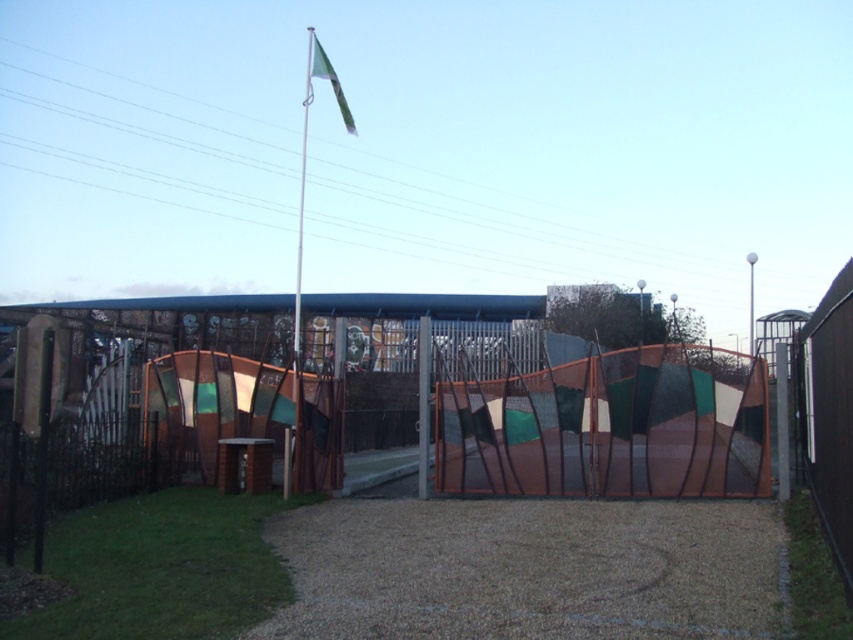
You are standing in front of the modern architectural structure and notice a white metallic flag pole at center and a green fabric flag at upper center. Which object is positioned to the left of the other?

The white metallic flag pole at center is to the left of the green fabric flag at upper center.

You are standing at the entrance of the modern architectural structure and want to reach the textured brown fence at center. Which direction should you walk to get there?

The textured brown fence at center is located at point coordinates, so you should walk towards the center of the scene to reach it.